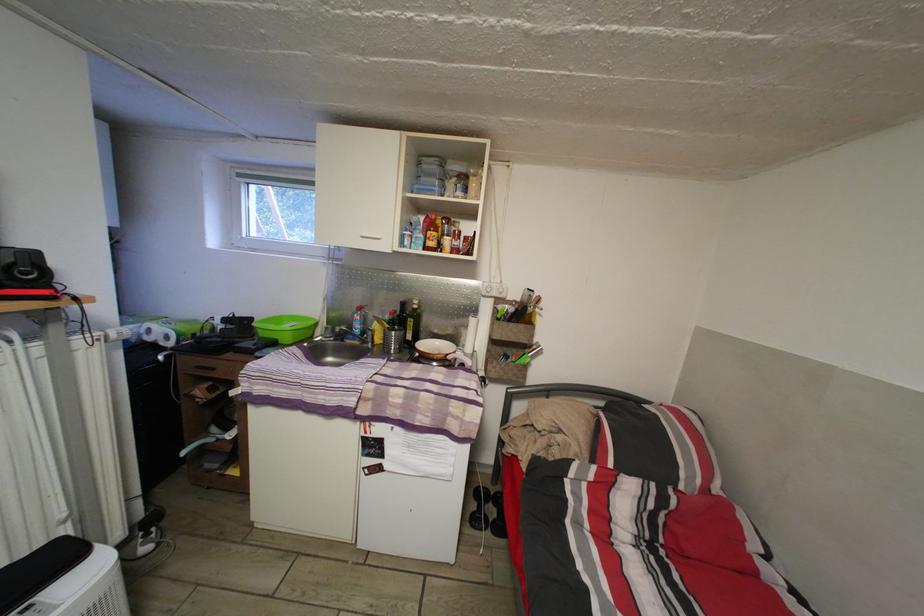
The image size is (924, 616). What do you see at coordinates (434, 349) in the screenshot?
I see `the small white bowl` at bounding box center [434, 349].